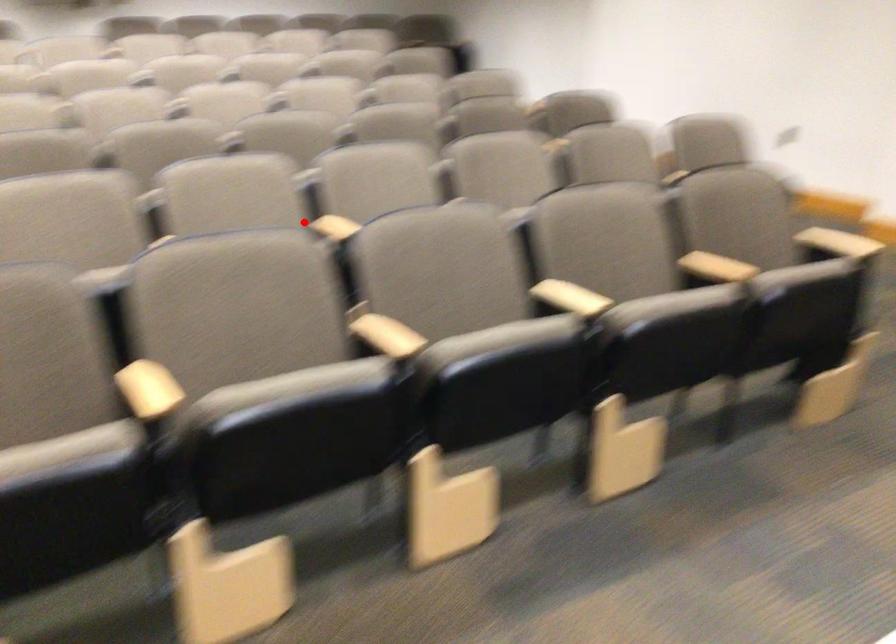
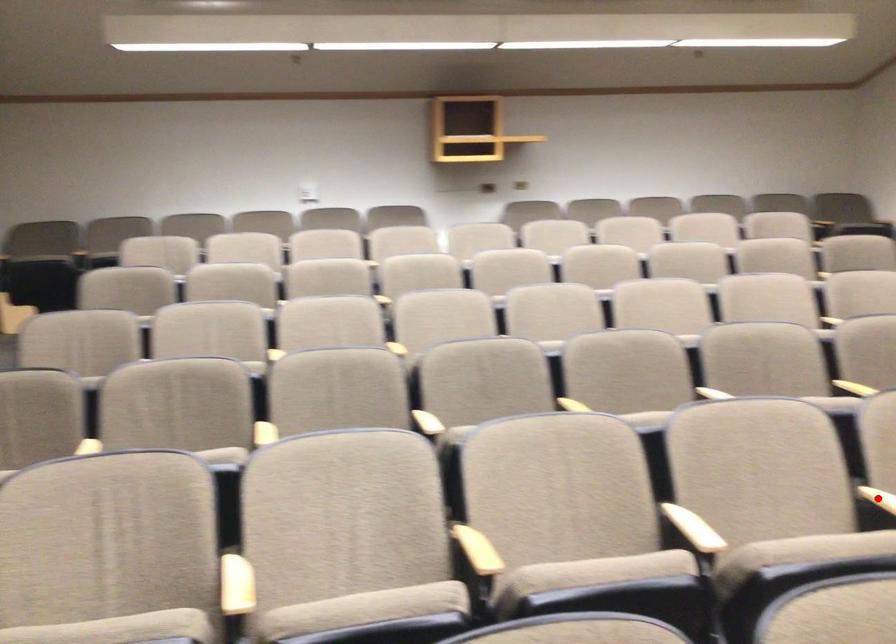
I am providing you with two images of the same scene from different viewpoints. A red point is marked on the first image and another point is marked on the second image. Are the points marked in image1 and image2 representing the same 3D position?

Yes